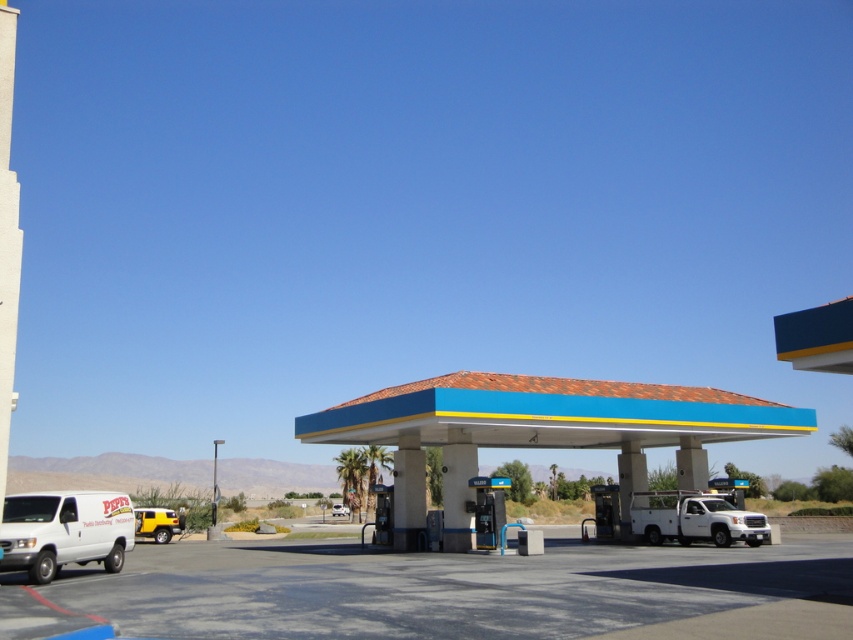
At what (x,y) coordinates should I click in order to perform the action: click on metallic yellow suv at lower left. Please return your answer as a coordinate pair (x, y). Looking at the image, I should click on (157, 524).

Can you confirm if metallic yellow suv at lower left is positioned below silver metallic suv at center?

No.

Does point (171, 529) lie behind point (347, 509)?

No, it is not.

Identify the location of metallic yellow suv at lower left. [x=157, y=524].

Is blue painted concrete gas station at center positioned before metallic yellow suv at lower left?

No.

Who is more forward, (688, 401) or (177, 525)?

Point (688, 401) is in front.

Locate an element on the screen. The height and width of the screenshot is (640, 853). blue painted concrete gas station at center is located at coordinates (538, 429).

Between blue painted concrete gas station at center and silver metallic suv at center, which one has more height?

With more height is blue painted concrete gas station at center.

Between blue painted concrete gas station at center and silver metallic suv at center, which one has less height?

Standing shorter between the two is silver metallic suv at center.

What do you see at coordinates (538, 429) in the screenshot?
I see `blue painted concrete gas station at center` at bounding box center [538, 429].

Where is `blue painted concrete gas station at center`? The width and height of the screenshot is (853, 640). blue painted concrete gas station at center is located at coordinates (538, 429).